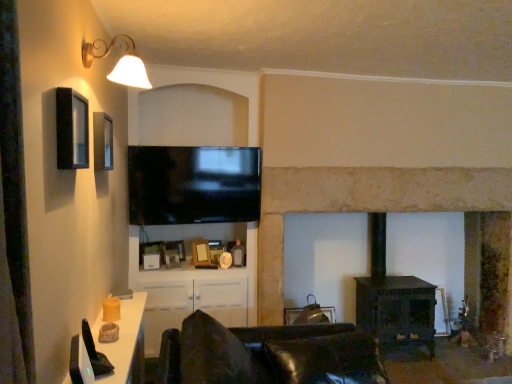
Question: From the image's perspective, is stone fireplace at center on matte black picture frame at upper left, which is the 2th picture frame in back-to-front order?

Choices:
 (A) no
 (B) yes

Answer: (A)

Question: Is stone fireplace at center wider than matte black picture frame at upper left, the second picture frame ordered from the bottom?

Choices:
 (A) yes
 (B) no

Answer: (A)

Question: Can we say stone fireplace at center lies outside matte black picture frame at upper left, the 1th picture frame viewed from the front?

Choices:
 (A) yes
 (B) no

Answer: (A)

Question: Is stone fireplace at center shorter than matte black picture frame at upper left, which is the 2th picture frame in back-to-front order?

Choices:
 (A) yes
 (B) no

Answer: (B)

Question: From a real-world perspective, is stone fireplace at center over matte black picture frame at upper left, which is the 2th picture frame in back-to-front order?

Choices:
 (A) yes
 (B) no

Answer: (B)

Question: Is stone fireplace at center positioned behind matte black picture frame at upper left, the 1th picture frame viewed from the front?

Choices:
 (A) yes
 (B) no

Answer: (A)

Question: Can you confirm if gold metallic wall sconce at upper left is taller than matte black picture frame at upper left, which is the 2th picture frame in back-to-front order?

Choices:
 (A) yes
 (B) no

Answer: (B)

Question: From a real-world perspective, is gold metallic wall sconce at upper left on matte black picture frame at upper left, the 1th picture frame viewed from the front?

Choices:
 (A) no
 (B) yes

Answer: (B)

Question: Is matte black picture frame at upper left, which is the 2th picture frame in back-to-front order, a part of gold metallic wall sconce at upper left?

Choices:
 (A) yes
 (B) no

Answer: (B)

Question: Is gold metallic wall sconce at upper left shorter than matte black picture frame at upper left, which is the 2th picture frame in back-to-front order?

Choices:
 (A) no
 (B) yes

Answer: (B)

Question: Is gold metallic wall sconce at upper left to the right of matte black picture frame at upper left, the 1th picture frame viewed from the front, from the viewer's perspective?

Choices:
 (A) yes
 (B) no

Answer: (A)

Question: Is gold metallic wall sconce at upper left further to camera compared to matte black picture frame at upper left, which is the 2th picture frame in back-to-front order?

Choices:
 (A) no
 (B) yes

Answer: (A)

Question: Is matte glass window at upper left aimed at white glossy table at lower left?

Choices:
 (A) no
 (B) yes

Answer: (A)